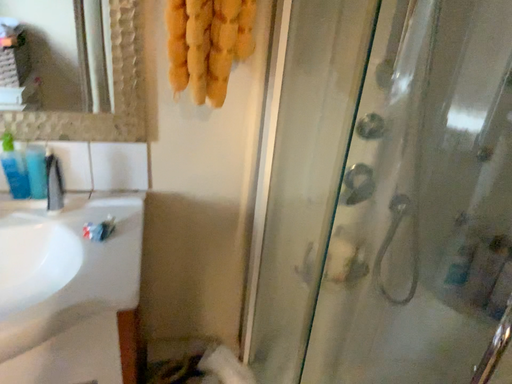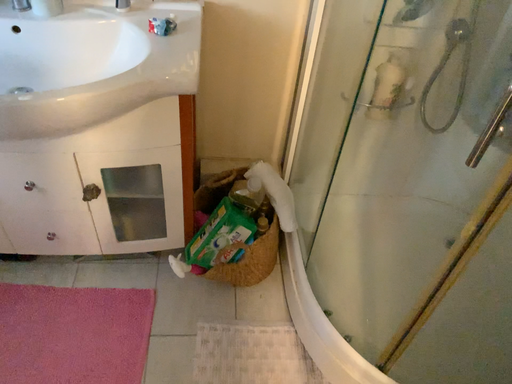
Question: How did the camera likely rotate when shooting the video?

Choices:
 (A) rotated downward
 (B) rotated upward

Answer: (A)